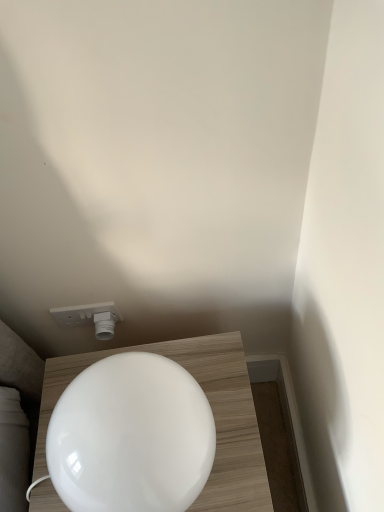
Question: From a real-world perspective, is white plastic socket at upper center beneath white glossy toilet at lower center?

Choices:
 (A) yes
 (B) no

Answer: (A)

Question: Does white plastic socket at upper center come in front of white glossy toilet at lower center?

Choices:
 (A) yes
 (B) no

Answer: (B)

Question: Does white plastic socket at upper center have a greater width compared to white glossy toilet at lower center?

Choices:
 (A) yes
 (B) no

Answer: (B)

Question: Is white plastic socket at upper center not inside white glossy toilet at lower center?

Choices:
 (A) yes
 (B) no

Answer: (A)

Question: Is white plastic socket at upper center shorter than white glossy toilet at lower center?

Choices:
 (A) no
 (B) yes

Answer: (B)

Question: From the image's perspective, is white plastic socket at upper center on top of white glossy toilet at lower center?

Choices:
 (A) no
 (B) yes

Answer: (B)

Question: Would you say white glossy toilet at lower center contains white plastic socket at upper center?

Choices:
 (A) no
 (B) yes

Answer: (A)

Question: Is the depth of white glossy toilet at lower center greater than that of white plastic socket at upper center?

Choices:
 (A) yes
 (B) no

Answer: (B)

Question: Does white glossy toilet at lower center have a smaller size compared to white plastic socket at upper center?

Choices:
 (A) yes
 (B) no

Answer: (B)

Question: Is white glossy toilet at lower center aimed at white plastic socket at upper center?

Choices:
 (A) yes
 (B) no

Answer: (B)

Question: Can you confirm if white glossy toilet at lower center is bigger than white plastic socket at upper center?

Choices:
 (A) yes
 (B) no

Answer: (A)

Question: Is white glossy toilet at lower center in front of white plastic socket at upper center?

Choices:
 (A) yes
 (B) no

Answer: (A)

Question: Considering their positions, is white glossy toilet at lower center located in front of or behind white plastic socket at upper center?

Choices:
 (A) behind
 (B) front

Answer: (B)